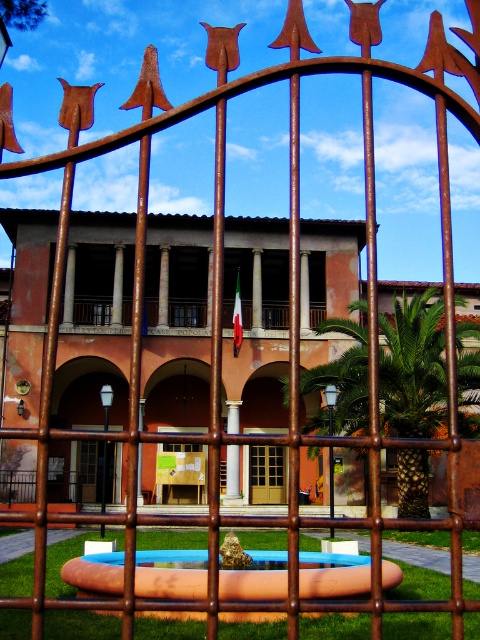
Question: Which object appears farthest from the camera in this image?

Choices:
 (A) brown polished stone pillar at center
 (B) brown wooden door at center
 (C) blue plastic pool at center

Answer: (B)

Question: Which of the following is the closest to the observer?

Choices:
 (A) blue plastic pool at center
 (B) brown polished stone pillar at center

Answer: (A)

Question: Which of the following is the farthest from the observer?

Choices:
 (A) brown wooden door at center
 (B) brown polished stone pillar at center

Answer: (A)

Question: Can you confirm if blue plastic pool at center is thinner than brown wooden door at center?

Choices:
 (A) no
 (B) yes

Answer: (A)

Question: Is blue plastic pool at center smaller than brown polished stone pillar at center?

Choices:
 (A) no
 (B) yes

Answer: (A)

Question: Does brown wooden door at center have a larger size compared to brown polished stone pillar at center?

Choices:
 (A) no
 (B) yes

Answer: (A)